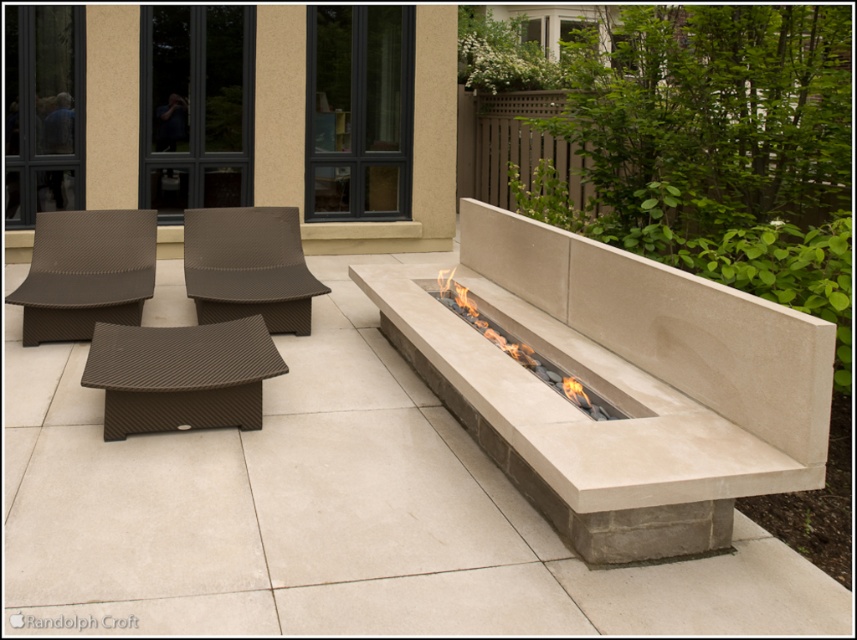
You are standing at the origin point of the coordinate system in the image. The brown textured bench at center is at coordinates 0.588, 0.211. If you want to move directly towards the bench, in which direction should you head?

The brown textured bench at center is located at coordinates 0.588 on the x and 0.211 on the y. Since you are at the origin, you should move towards the positive x and positive y direction to reach it.

You are a guest at a party in this outdoor seating area. You want to sit on the lower chair. Which one should you choose between the brown woven chair at left and the brown woven chair at center?

The brown woven chair at left has a lesser height compared to the brown woven chair at center, so you should choose the brown woven chair at left to sit on.

You are sitting on the brown woven chair at center and want to move to the brown woven chair at left. In which direction should you move?

You should move to the left to reach the brown woven chair at left since it is positioned to the left of the brown woven chair at center.